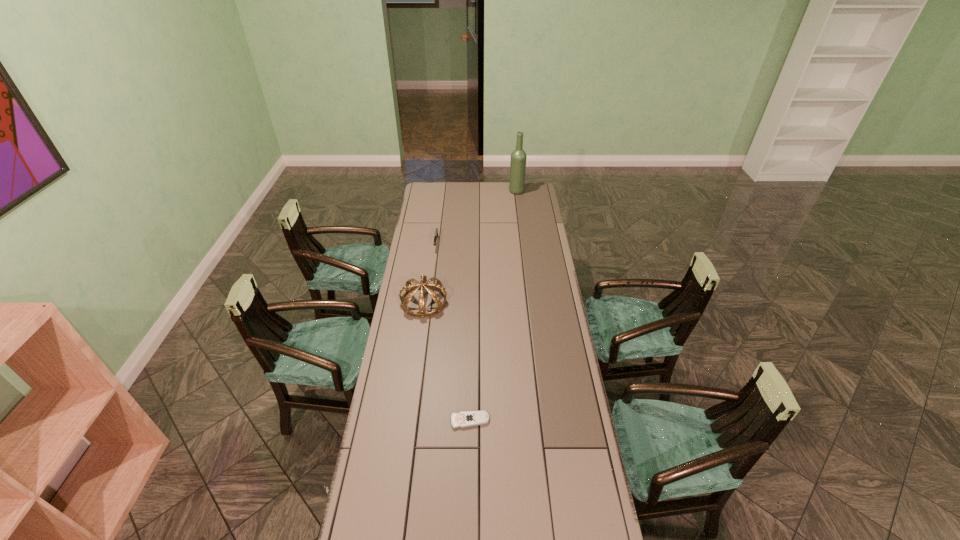
The height and width of the screenshot is (540, 960). In order to click on vacant space at the far left corner in this screenshot , I will do `click(444, 199)`.

Where is `free space at the far right corner`? The image size is (960, 540). free space at the far right corner is located at coordinates (525, 197).

Locate an element on the screen. The image size is (960, 540). free area in between the third object from left to right and the tiara is located at coordinates (447, 361).

You are a GUI agent. You are given a task and a screenshot of the screen. Output one action in this format:
    pyautogui.click(x=<x>, y=<y>)
    Task: Click on the empty space between the third nearest object and the shortest object
    This screenshot has height=540, width=960.
    Given the screenshot: What is the action you would take?
    pyautogui.click(x=453, y=332)

What are the coordinates of `unoccupied area between the second object from right to left and the third nearest object` in the screenshot? It's located at (453, 332).

Locate an element on the screen. The height and width of the screenshot is (540, 960). vacant region between the wine bottle and the second object from right to left is located at coordinates (493, 306).

Locate an element on the screen. vacant area that lies between the rightmost object and the third object from left to right is located at coordinates point(493,306).

Where is `vacant space in between the third farthest object and the rightmost object`? vacant space in between the third farthest object and the rightmost object is located at coordinates (470, 247).

This screenshot has width=960, height=540. What are the coordinates of `the closest object to the gun` in the screenshot? It's located at [410, 289].

Image resolution: width=960 pixels, height=540 pixels. Identify the location of object that is the closest to the tallest object. (436, 230).